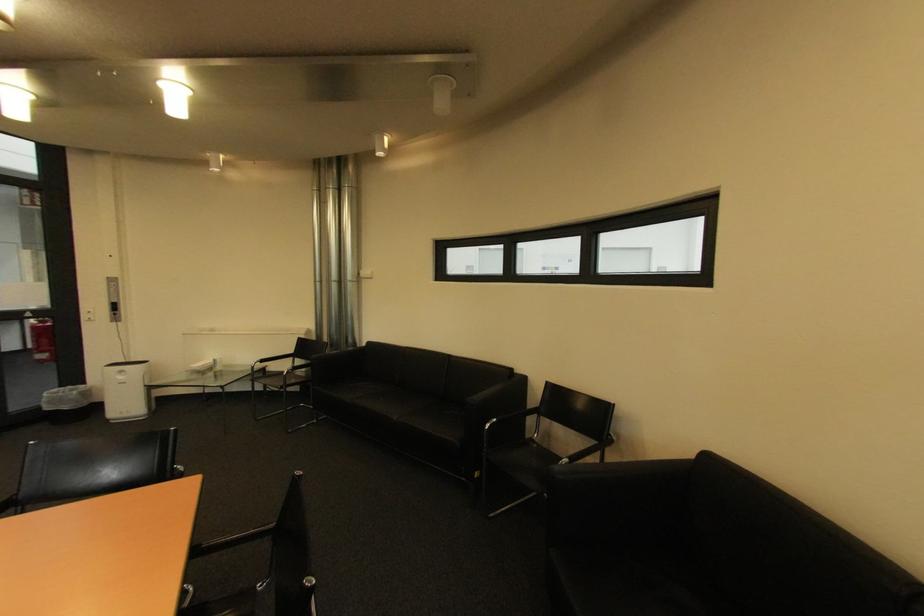
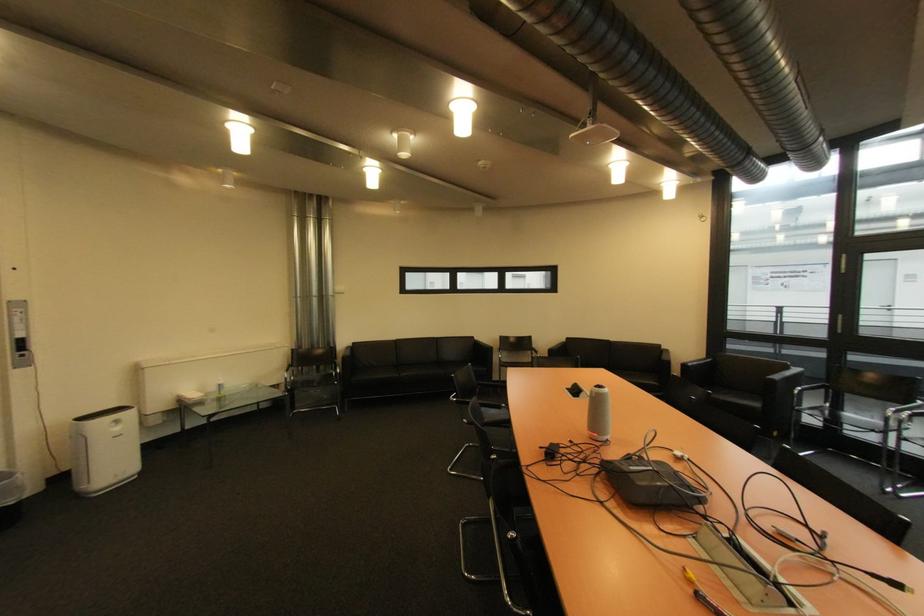
Find the pixel in the second image that matches [129,379] in the first image.

(124, 430)